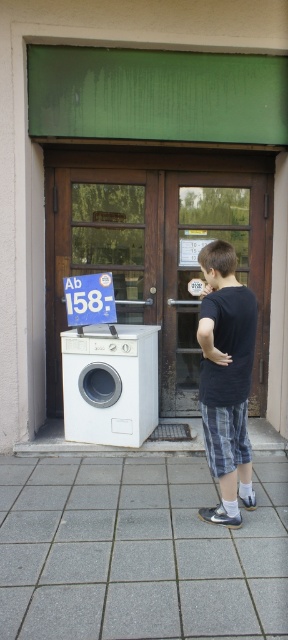
Question: Among these points, which one is nearest to the camera?

Choices:
 (A) (76, 627)
 (B) (95, 355)
 (C) (124, 240)
 (D) (205, 307)

Answer: (A)

Question: Which point appears closest to the camera in this image?

Choices:
 (A) (122, 259)
 (B) (52, 540)
 (C) (137, 333)
 (D) (256, 314)

Answer: (B)

Question: Does white plastic washing machine at lower left appear under dark blue cotton shirt at center?

Choices:
 (A) yes
 (B) no

Answer: (B)

Question: Based on their relative distances, which object is nearer to the white glossy washing machine at left?

Choices:
 (A) dark blue cotton shirt at center
 (B) gray concrete pavement at lower center
 (C) white plastic washing machine at lower left

Answer: (C)

Question: Is white plastic washing machine at lower left to the right of dark blue cotton shirt at center from the viewer's perspective?

Choices:
 (A) yes
 (B) no

Answer: (B)

Question: Is gray concrete pavement at lower center to the left of white glossy washing machine at left from the viewer's perspective?

Choices:
 (A) no
 (B) yes

Answer: (A)